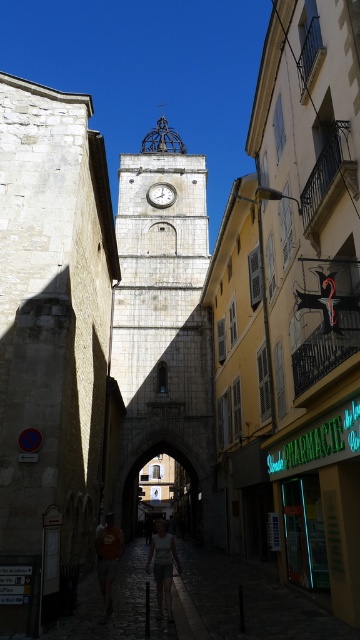
Question: Considering the real-world distances, which object is closest to the white cotton shirt at center?

Choices:
 (A) stone clock tower at center
 (B) silver metallic clock at center

Answer: (A)

Question: Is stone clock tower at center positioned in front of orange cotton shirt at lower center?

Choices:
 (A) yes
 (B) no

Answer: (B)

Question: Does stone clock tower at center lie in front of white cotton shirt at center?

Choices:
 (A) no
 (B) yes

Answer: (A)

Question: Among these objects, which one is farthest from the camera?

Choices:
 (A) orange cotton shirt at lower center
 (B) stone clock tower at center
 (C) white cotton shirt at center

Answer: (B)

Question: Can you confirm if white cotton shirt at center is bigger than silver metallic clock at center?

Choices:
 (A) yes
 (B) no

Answer: (A)

Question: Which point is closer to the camera taking this photo?

Choices:
 (A) (151, 195)
 (B) (168, 532)
 (C) (100, 577)

Answer: (C)